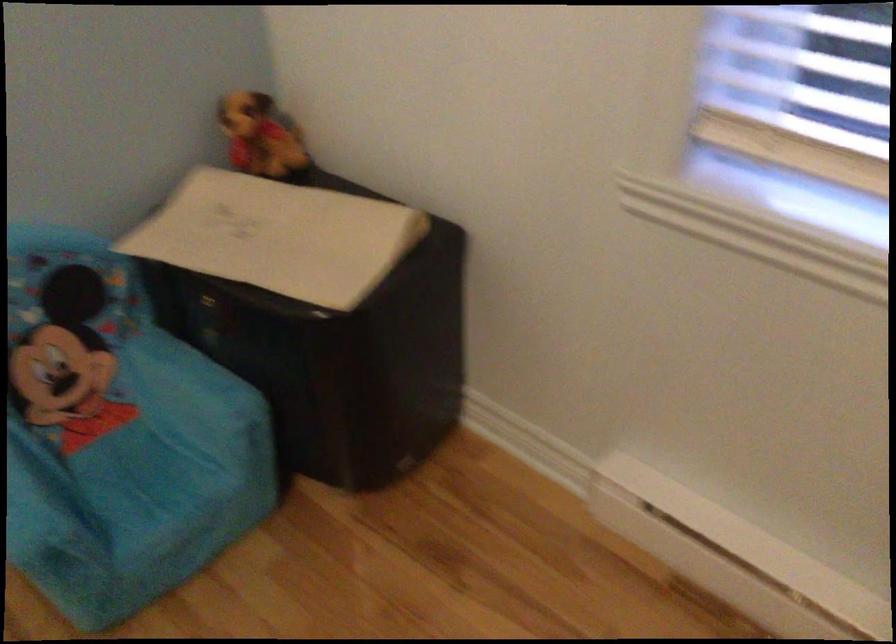
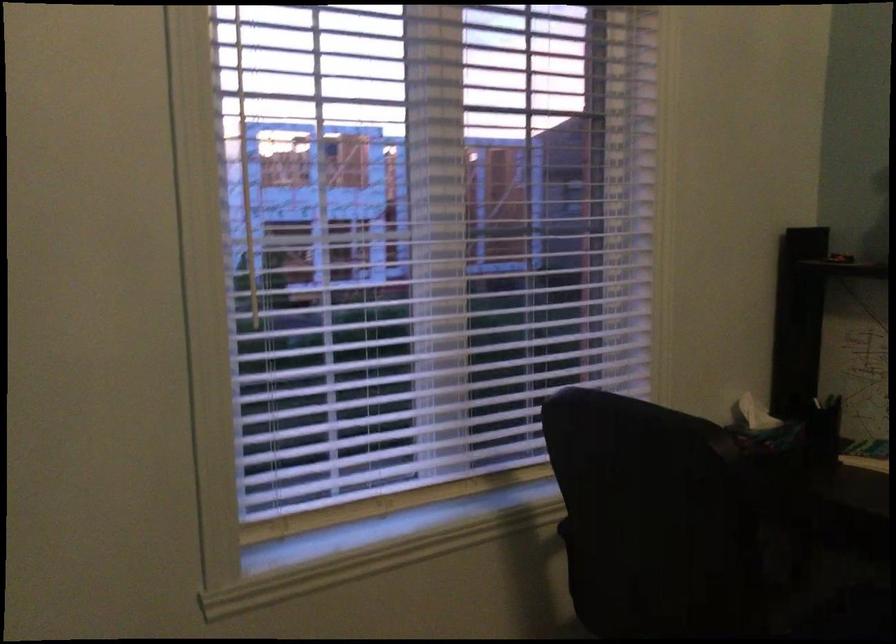
Question: Based on the continuous images, in which direction is the camera rotating? Reply with the corresponding letter.

Choices:
 (A) Left
 (B) Right
 (C) Up
 (D) Down

Answer: (B)